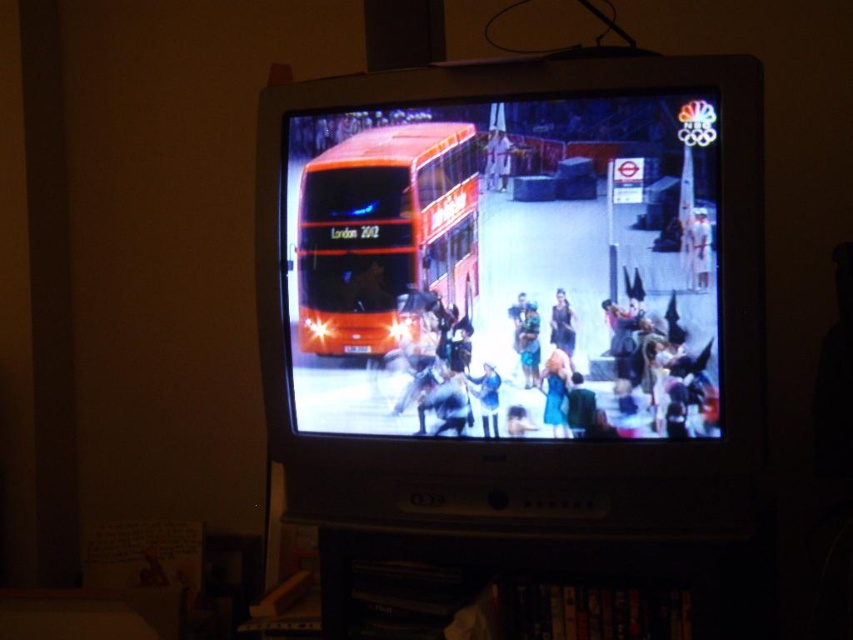
Can you confirm if matte black dress at center is taller than shiny orange bus at center?

Incorrect, matte black dress at center's height is not larger of shiny orange bus at center's.

Is matte black dress at center positioned at the back of shiny orange bus at center?

No, matte black dress at center is closer to the viewer.

Is point (630, 428) in front of point (430, 122)?

Yes.

The image size is (853, 640). I want to click on matte black dress at center, so click(x=550, y=372).

Can you confirm if metallic silver television at center is bigger than shiny orange bus at center?

Yes, metallic silver television at center is bigger than shiny orange bus at center.

The image size is (853, 640). Identify the location of metallic silver television at center. (515, 291).

Is point (519, 420) closer to viewer compared to point (569, 346)?

No, (519, 420) is further to viewer.

Is metallic silver television at center wider than black satin dress at center?

Correct, the width of metallic silver television at center exceeds that of black satin dress at center.

Is point (585, 72) closer to viewer compared to point (567, 332)?

Yes, it is in front of point (567, 332).

Identify the location of metallic silver television at center. Image resolution: width=853 pixels, height=640 pixels. (515, 291).